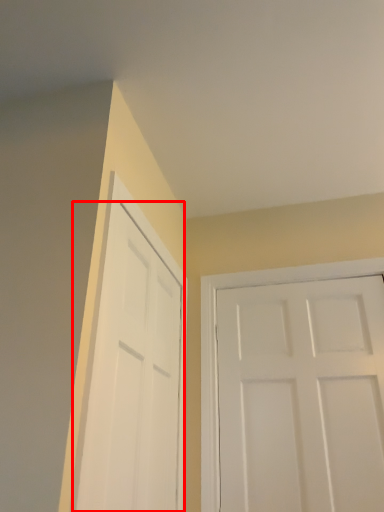
Question: In this image, where is door (annotated by the red box) located relative to door?

Choices:
 (A) left
 (B) right

Answer: (A)